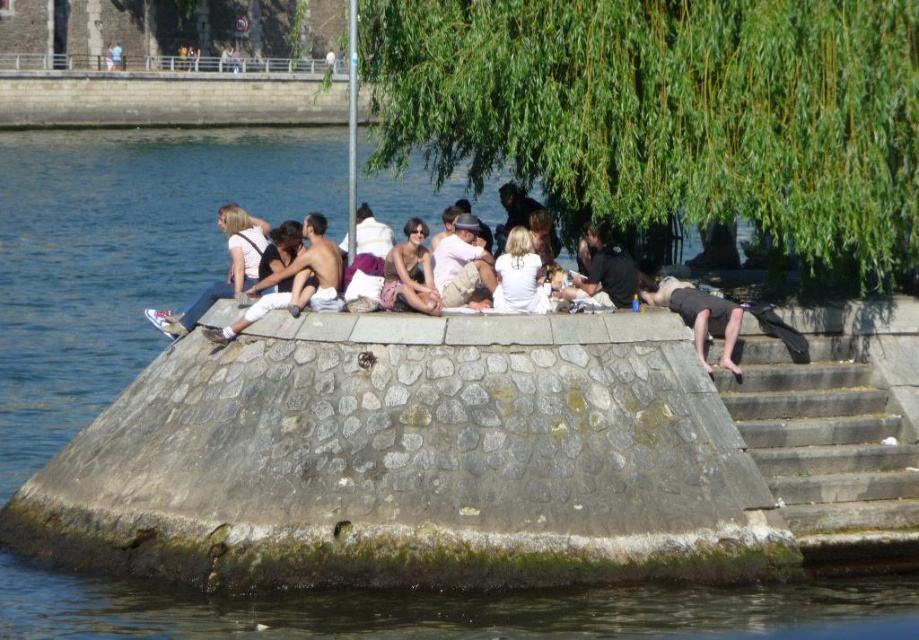
Is dark gray stone person at lower right to the right of light brown cotton pants at center from the viewer's perspective?

Correct, you'll find dark gray stone person at lower right to the right of light brown cotton pants at center.

What do you see at coordinates (698, 316) in the screenshot? I see `dark gray stone person at lower right` at bounding box center [698, 316].

Between point (698, 316) and point (460, 288), which one is positioned behind?

The point (460, 288) is behind.

Find the location of `dark gray stone person at lower right`. dark gray stone person at lower right is located at coordinates (698, 316).

Is dark gray stone person at lower right positioned behind black cotton shirt at center?

That is False.

Is dark gray stone person at lower right bigger than black cotton shirt at center?

Correct, dark gray stone person at lower right is larger in size than black cotton shirt at center.

Which is in front, point (687, 298) or point (608, 244)?

Point (687, 298)

The width and height of the screenshot is (919, 640). I want to click on dark gray stone person at lower right, so tap(698, 316).

Who is more distant from viewer, (825, 356) or (407, 221)?

Point (407, 221)

What do you see at coordinates (823, 436) in the screenshot?
I see `stone stairs at lower right` at bounding box center [823, 436].

At what (x,y) coordinates should I click in order to perform the action: click on stone stairs at lower right. Please return your answer as a coordinate pair (x, y). The image size is (919, 640). Looking at the image, I should click on (823, 436).